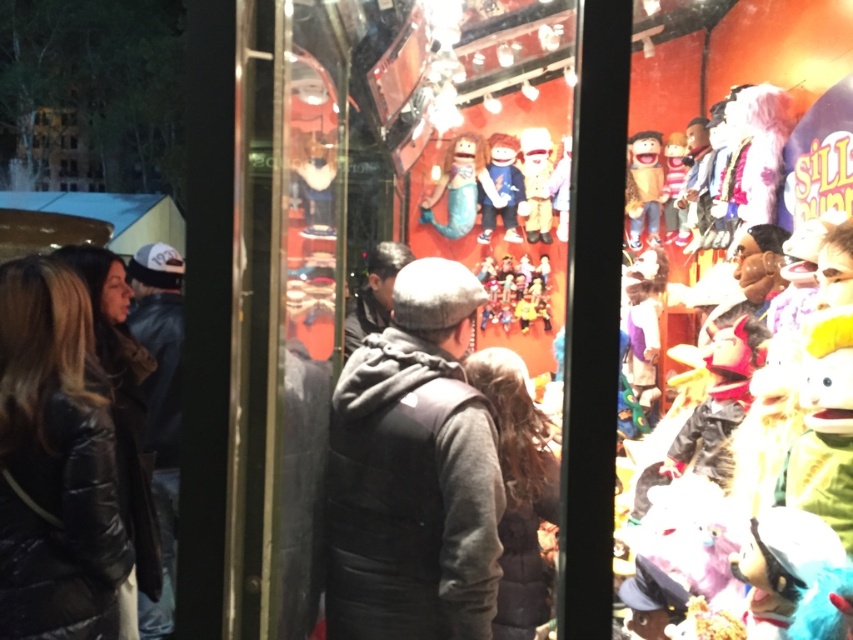
Question: Estimate the real-world distances between objects in this image. Which object is farther from the purple plush toy at center?

Choices:
 (A) velvet plush doll at center
 (B) matte brown mask at right
 (C) gray fuzzy sweater at center
 (D) yellow plush toy at right

Answer: (D)

Question: Is matte brown mask at right thinner than velvet plush doll at center?

Choices:
 (A) no
 (B) yes

Answer: (B)

Question: Can you confirm if matte wooden dolls at center is wider than purple plush toy at center?

Choices:
 (A) no
 (B) yes

Answer: (B)

Question: Which of the following is the farthest from the observer?

Choices:
 (A) (521, 148)
 (B) (714, 310)
 (C) (518, 632)

Answer: (A)

Question: Which object is positioned farthest from the striped fabric puppet at center?

Choices:
 (A) matte brown mask at right
 (B) gray fuzzy sweater at center
 (C) matte blue fabric mermaid at center
 (D) purple plush toy at center

Answer: (B)

Question: Can you confirm if matte wooden dolls at center is bigger than matte yellow plush at upper right?

Choices:
 (A) no
 (B) yes

Answer: (B)